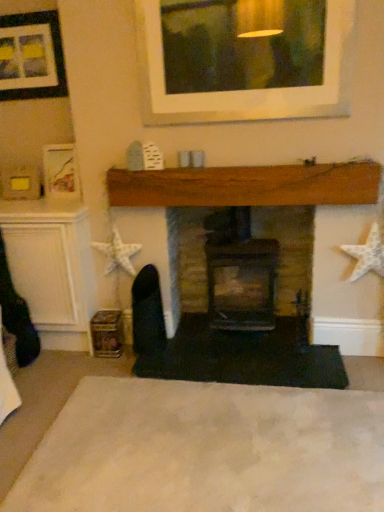
Question: Can you confirm if wooden fireplace at center, arranged as the second fireplace when viewed from the right, is positioned to the right of brick fireplace at center, placed as the second fireplace when sorted from left to right?

Choices:
 (A) yes
 (B) no

Answer: (B)

Question: Considering the relative sizes of wooden fireplace at center, which is the 1th fireplace in left-to-right order, and brick fireplace at center, placed as the second fireplace when sorted from left to right, in the image provided, is wooden fireplace at center, which is the 1th fireplace in left-to-right order, bigger than brick fireplace at center, placed as the second fireplace when sorted from left to right,?

Choices:
 (A) no
 (B) yes

Answer: (A)

Question: Is wooden fireplace at center, which is the 1th fireplace in left-to-right order, shorter than brick fireplace at center, the first fireplace from the right?

Choices:
 (A) no
 (B) yes

Answer: (A)

Question: Considering the relative sizes of wooden fireplace at center, which is the 1th fireplace in left-to-right order, and brick fireplace at center, the first fireplace from the right, in the image provided, is wooden fireplace at center, which is the 1th fireplace in left-to-right order, wider than brick fireplace at center, the first fireplace from the right,?

Choices:
 (A) no
 (B) yes

Answer: (A)

Question: From a real-world perspective, is wooden fireplace at center, which is the 1th fireplace in left-to-right order, over brick fireplace at center, the first fireplace from the right?

Choices:
 (A) yes
 (B) no

Answer: (A)

Question: In terms of size, does wooden fireplace at center, which is the 1th fireplace in left-to-right order, appear bigger or smaller than matte black picture frame at upper left?

Choices:
 (A) big
 (B) small

Answer: (A)

Question: From the image's perspective, is wooden fireplace at center, which is the 1th fireplace in left-to-right order, located above or below matte black picture frame at upper left?

Choices:
 (A) below
 (B) above

Answer: (A)

Question: Relative to matte black picture frame at upper left, is wooden fireplace at center, arranged as the second fireplace when viewed from the right, in front or behind?

Choices:
 (A) front
 (B) behind

Answer: (A)

Question: From their relative heights in the image, would you say wooden fireplace at center, which is the 1th fireplace in left-to-right order, is taller or shorter than matte black picture frame at upper left?

Choices:
 (A) tall
 (B) short

Answer: (A)

Question: Is matte black picture frame at upper left inside the boundaries of wooden fireplace at center, which is the 1th fireplace in left-to-right order, or outside?

Choices:
 (A) inside
 (B) outside

Answer: (B)

Question: In the image, is matte black picture frame at upper left positioned in front of or behind wooden fireplace at center, arranged as the second fireplace when viewed from the right?

Choices:
 (A) front
 (B) behind

Answer: (B)

Question: From the image's perspective, is matte black picture frame at upper left positioned above or below wooden fireplace at center, which is the 1th fireplace in left-to-right order?

Choices:
 (A) above
 (B) below

Answer: (A)

Question: Does point (23, 29) appear closer or farther from the camera than point (134, 330)?

Choices:
 (A) closer
 (B) farther

Answer: (B)

Question: Is white soft carpet at lower center wider or thinner than wooden fireplace at center, arranged as the second fireplace when viewed from the right?

Choices:
 (A) wide
 (B) thin

Answer: (A)

Question: Does point pos(256,435) appear closer or farther from the camera than point pos(152,279)?

Choices:
 (A) farther
 (B) closer

Answer: (B)